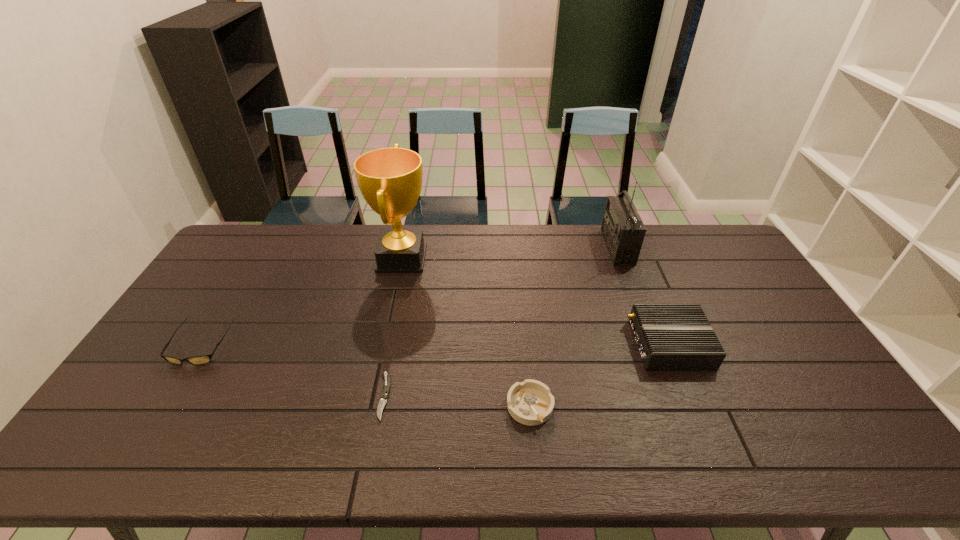
Identify the location of vacant space that satisfies the following two spatial constraints: 1. on the front-facing side of the sunglasses; 2. on the left side of the ashtray. The height and width of the screenshot is (540, 960). (163, 407).

Where is `vacant region that satisfies the following two spatial constraints: 1. on the front-facing side of the third object from right to left; 2. on the left side of the third shortest object`? The height and width of the screenshot is (540, 960). vacant region that satisfies the following two spatial constraints: 1. on the front-facing side of the third object from right to left; 2. on the left side of the third shortest object is located at coordinates (163, 407).

You are a GUI agent. You are given a task and a screenshot of the screen. Output one action in this format:
    pyautogui.click(x=<x>, y=<y>)
    Task: Click on the blank space that satisfies the following two spatial constraints: 1. on the front panel of the radio receiver; 2. on the front side of the pocketknife
    The height and width of the screenshot is (540, 960).
    Given the screenshot: What is the action you would take?
    pyautogui.click(x=675, y=396)